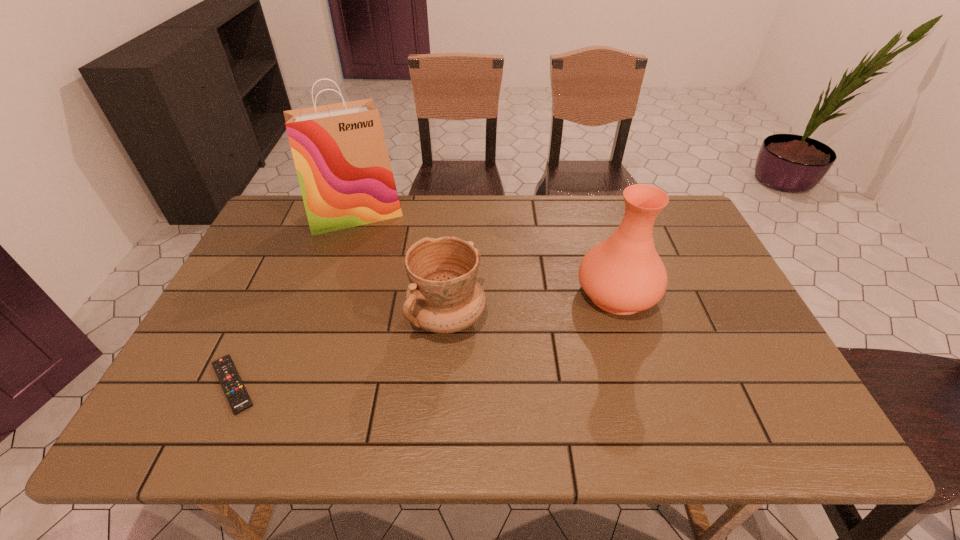
You are a GUI agent. You are given a task and a screenshot of the screen. Output one action in this format:
    pyautogui.click(x=<x>, y=<y>)
    Task: Click on the free spot located on the back of the pottery
    The width and height of the screenshot is (960, 540).
    Given the screenshot: What is the action you would take?
    pyautogui.click(x=452, y=234)

Find the location of a particular element. vacant area situated on the back of the shortest object is located at coordinates (271, 304).

The height and width of the screenshot is (540, 960). Identify the location of object located at the far edge. click(339, 150).

Locate an element on the screen. This screenshot has width=960, height=540. object at the near edge is located at coordinates (237, 396).

You are a GUI agent. You are given a task and a screenshot of the screen. Output one action in this format:
    pyautogui.click(x=<x>, y=<y>)
    Task: Click on the shopping bag that is at the left edge
    This screenshot has height=540, width=960.
    Given the screenshot: What is the action you would take?
    pyautogui.click(x=339, y=150)

Locate an element on the screen. This screenshot has width=960, height=540. remote control that is at the left edge is located at coordinates (237, 396).

Identify the location of object at the far left corner. (339, 150).

Identify the location of object that is at the near left corner. Image resolution: width=960 pixels, height=540 pixels. (237, 396).

Where is `vacant region at the far edge of the desktop`? vacant region at the far edge of the desktop is located at coordinates coord(536,231).

Identify the location of vacant point at the near edge. Image resolution: width=960 pixels, height=540 pixels. (683, 420).